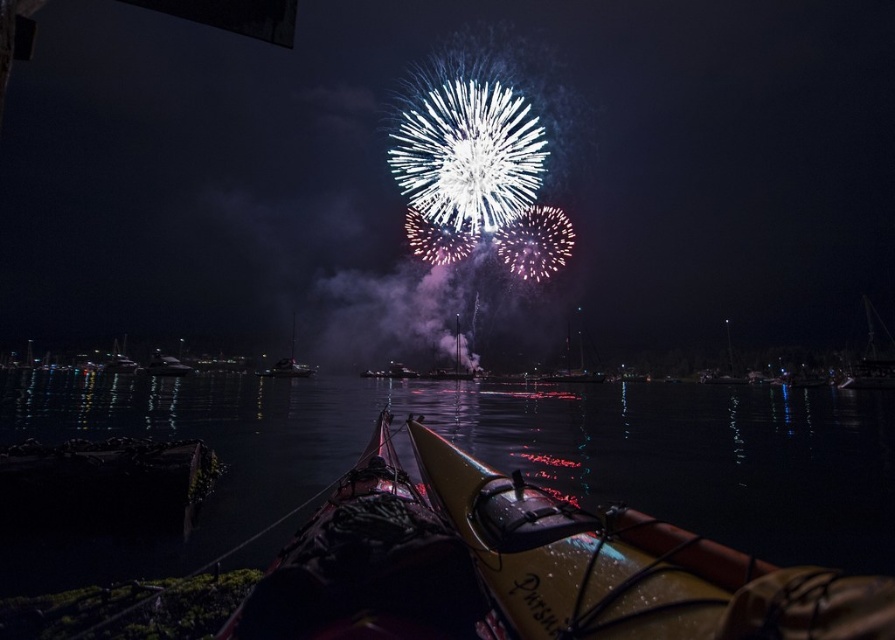
Question: Which object is positioned closest to the glossy water at center?

Choices:
 (A) metallic yellow kayak at center
 (B) yellow matte canoe at center

Answer: (B)

Question: Can you confirm if metallic yellow kayak at center is positioned above yellow matte canoe at center?

Choices:
 (A) no
 (B) yes

Answer: (B)

Question: Among these points, which one is nearest to the camera?

Choices:
 (A) (358, 506)
 (B) (640, 234)
 (C) (260, 456)

Answer: (A)

Question: Is metallic yellow kayak at center further to the viewer compared to yellow matte canoe at center?

Choices:
 (A) no
 (B) yes

Answer: (B)

Question: Is glossy water at center positioned behind yellow matte canoe at center?

Choices:
 (A) no
 (B) yes

Answer: (B)

Question: Which object appears closest to the camera in this image?

Choices:
 (A) yellow matte canoe at center
 (B) metallic yellow kayak at center
 (C) glossy water at center

Answer: (A)